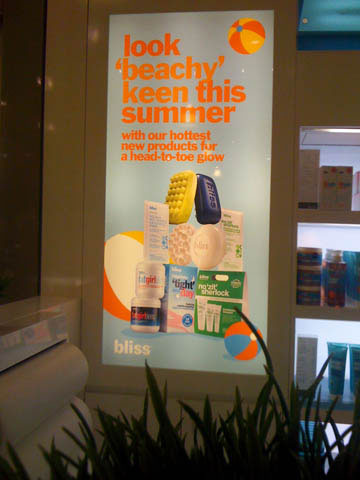
This screenshot has width=360, height=480. Identify the location of cylindrical container. (308, 300), (311, 276), (311, 259).